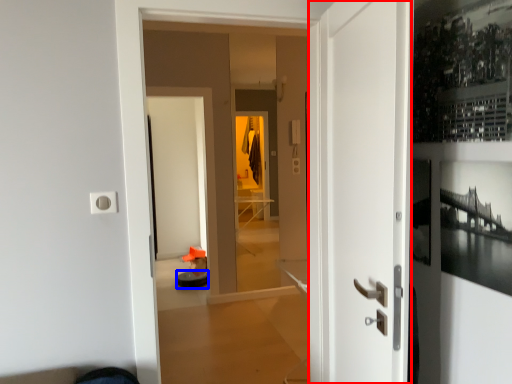
Question: Which of the following is the farthest to the observer, door (highlighted by a red box) or furniture (highlighted by a blue box)?

Choices:
 (A) door
 (B) furniture

Answer: (B)